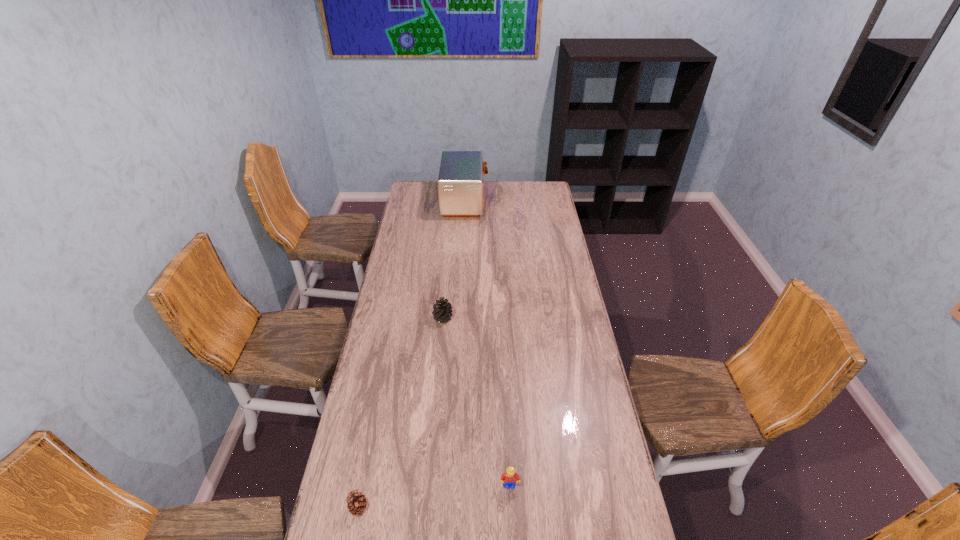
This screenshot has height=540, width=960. I want to click on vacant space that is in between the shorter pinecone and the farthest object, so 412,354.

This screenshot has width=960, height=540. What are the coordinates of `vacant region between the nearest object and the farther pinecone` in the screenshot? It's located at (400, 413).

Locate an element on the screen. The height and width of the screenshot is (540, 960). vacant area between the toaster oven and the leftmost object is located at coordinates (412, 354).

The image size is (960, 540). Identify the location of vacant space in between the Lego and the farthest object. (488, 343).

At what (x,y) coordinates should I click in order to perform the action: click on free space between the nearest object and the right pinecone. Please return your answer as a coordinate pair (x, y). Looking at the image, I should click on (400, 413).

You are a GUI agent. You are given a task and a screenshot of the screen. Output one action in this format:
    pyautogui.click(x=<x>, y=<y>)
    Task: Click on the vacant area that lies between the taller pinecone and the shorter pinecone
    The image size is (960, 540).
    Given the screenshot: What is the action you would take?
    pyautogui.click(x=400, y=413)

Find the location of a particular element. vacant space in between the farther pinecone and the shorter pinecone is located at coordinates (400, 413).

Where is `empty space that is in between the tallest object and the nearest object`? Image resolution: width=960 pixels, height=540 pixels. empty space that is in between the tallest object and the nearest object is located at coordinates (412, 354).

Locate an element on the screen. This screenshot has width=960, height=540. object that stands as the third closest to the left pinecone is located at coordinates (460, 182).

Select which object is the closest to the toaster oven. Please provide its 2D coordinates. Your answer should be formatted as a tuple, i.e. [(x, y)], where the tuple contains the x and y coordinates of a point satisfying the conditions above.

[(442, 312)]